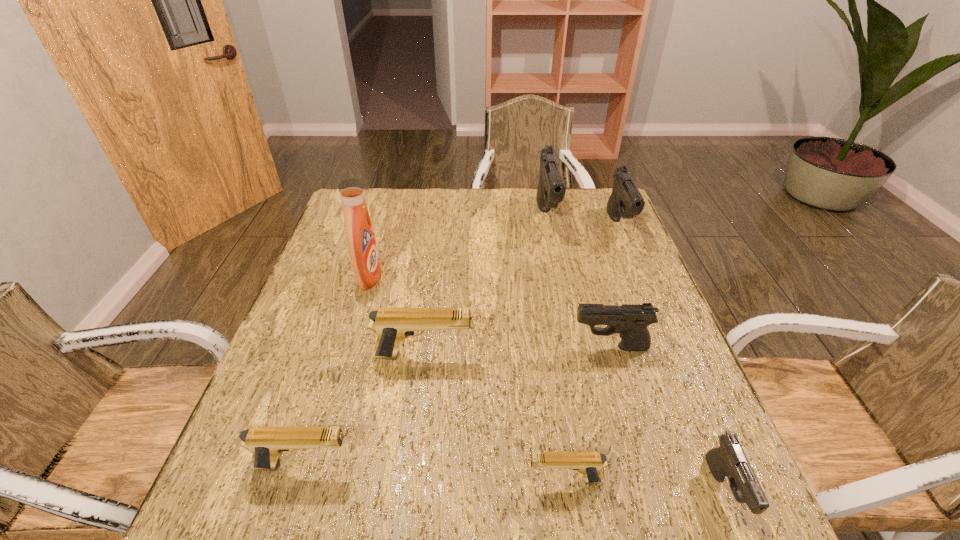
At what (x,y) coordinates should I click in order to perform the action: click on free space between the tallest pistol and the second nearest tan pistol. Please return your answer as a coordinate pair (x, y). The height and width of the screenshot is (540, 960). Looking at the image, I should click on (425, 341).

The width and height of the screenshot is (960, 540). I want to click on vacant space that is in between the sixth shortest object and the second nearest black pistol, so click(x=614, y=287).

Find the location of a particular element. This screenshot has height=540, width=960. object that is the closest to the biggest tan pistol is located at coordinates (362, 246).

Locate an element on the screen. This screenshot has height=540, width=960. the fourth closest object to the smallest black pistol is located at coordinates (626, 201).

I want to click on pistol that stands as the second closest to the third farthest black pistol, so click(x=729, y=460).

In order to click on pistol that stands as the fourth closest to the smallest black pistol in this screenshot , I will do `click(626, 201)`.

Choose which black pistol is the third nearest neighbor to the third smallest black pistol. Please provide its 2D coordinates. Your answer should be formatted as a tuple, i.e. [(x, y)], where the tuple contains the x and y coordinates of a point satisfying the conditions above.

[(729, 460)]

Locate an element on the screen. The image size is (960, 540). the third closest black pistol to the shortest object is located at coordinates pos(626,201).

Point out which tan pistol is positioned as the second nearest to the second smallest tan pistol. Please provide its 2D coordinates. Your answer should be formatted as a tuple, i.e. [(x, y)], where the tuple contains the x and y coordinates of a point satisfying the conditions above.

[(590, 464)]

Choose which tan pistol is the nearest neighbor to the third tallest object. Please provide its 2D coordinates. Your answer should be formatted as a tuple, i.e. [(x, y)], where the tuple contains the x and y coordinates of a point satisfying the conditions above.

[(392, 325)]